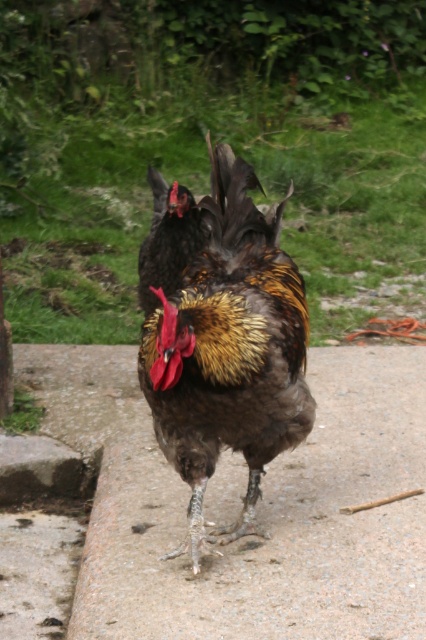
Question: Among these points, which one is nearest to the camera?

Choices:
 (A) (362, 480)
 (B) (224, 156)

Answer: (B)

Question: In this image, where is gray concrete pavement at center located relative to brown feathered rooster at center?

Choices:
 (A) right
 (B) left

Answer: (A)

Question: Is gray concrete pavement at center thinner than brown feathered rooster at center?

Choices:
 (A) yes
 (B) no

Answer: (B)

Question: Considering the relative positions of gray concrete pavement at center and brown feathered rooster at center in the image provided, where is gray concrete pavement at center located with respect to brown feathered rooster at center?

Choices:
 (A) above
 (B) below

Answer: (B)

Question: Which point appears farthest from the camera in this image?

Choices:
 (A) (259, 376)
 (B) (132, 369)

Answer: (B)